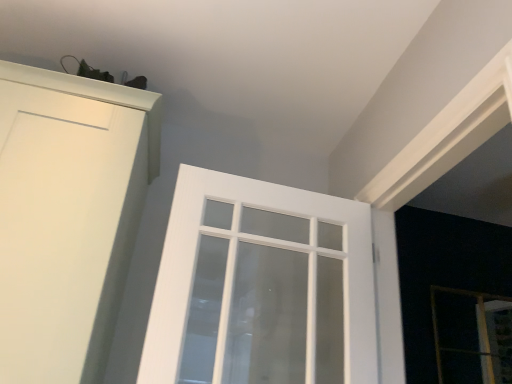
What do you see at coordinates (480, 326) in the screenshot? This screenshot has height=384, width=512. I see `transparent glass screen door at lower right` at bounding box center [480, 326].

This screenshot has width=512, height=384. I want to click on transparent glass screen door at lower right, so click(480, 326).

What is the approximate width of transparent glass screen door at lower right?

transparent glass screen door at lower right is 1.77 inches in width.

The image size is (512, 384). Find the location of `white textured glass door at center`. white textured glass door at center is located at coordinates (261, 286).

Describe the element at coordinates (261, 286) in the screenshot. I see `white textured glass door at center` at that location.

This screenshot has width=512, height=384. I want to click on transparent glass screen door at lower right, so click(480, 326).

Which is more to the left, transparent glass screen door at lower right or white textured glass door at center?

white textured glass door at center.

Is transparent glass screen door at lower right closer to the viewer compared to white textured glass door at center?

That is False.

Does point (478, 298) come behind point (272, 336)?

That is True.

From the image's perspective, is transparent glass screen door at lower right located above white textured glass door at center?

Actually, transparent glass screen door at lower right appears below white textured glass door at center in the image.

In the scene shown: From a real-world perspective, is transparent glass screen door at lower right positioned under white textured glass door at center based on gravity?

No, from a real-world perspective, transparent glass screen door at lower right is not below white textured glass door at center.

Between transparent glass screen door at lower right and white textured glass door at center, which one has smaller width?

With smaller width is transparent glass screen door at lower right.

Can you confirm if transparent glass screen door at lower right is shorter than white textured glass door at center?

Yes.

In the scene shown: Who is smaller, transparent glass screen door at lower right or white textured glass door at center?

With smaller size is transparent glass screen door at lower right.

Would you say white textured glass door at center is part of transparent glass screen door at lower right's contents?

No, white textured glass door at center is not a part of transparent glass screen door at lower right.

From the picture: Are transparent glass screen door at lower right and white textured glass door at center located far from each other?

No, transparent glass screen door at lower right is in close proximity to white textured glass door at center.

Does transparent glass screen door at lower right turn towards white textured glass door at center?

No, transparent glass screen door at lower right is not aimed at white textured glass door at center.

Find the location of `screen door below the white textured glass door at center (from the image's perspective)`. screen door below the white textured glass door at center (from the image's perspective) is located at coordinates (480, 326).

Can you confirm if white textured glass door at center is positioned to the right of transparent glass screen door at lower right?

No, white textured glass door at center is not to the right of transparent glass screen door at lower right.

In the scene shown: Is white textured glass door at center closer to camera compared to transparent glass screen door at lower right?

Yes.

Which point is more distant from viewer, [359,301] or [442,376]?

Positioned behind is point [442,376].

From the image's perspective, is white textured glass door at center above transparent glass screen door at lower right?

Yes, from the image's perspective, white textured glass door at center is over transparent glass screen door at lower right.

From a real-world perspective, is white textured glass door at center physically located above or below transparent glass screen door at lower right?

In terms of real-world spatial position, white textured glass door at center is below transparent glass screen door at lower right.

Between white textured glass door at center and transparent glass screen door at lower right, which one has smaller width?

Thinner between the two is transparent glass screen door at lower right.

Which of these two, white textured glass door at center or transparent glass screen door at lower right, stands shorter?

Standing shorter between the two is transparent glass screen door at lower right.

Considering the sizes of objects white textured glass door at center and transparent glass screen door at lower right in the image provided, who is bigger, white textured glass door at center or transparent glass screen door at lower right?

white textured glass door at center is bigger.

Could transparent glass screen door at lower right be considered to be inside white textured glass door at center?

No, transparent glass screen door at lower right is located outside of white textured glass door at center.

Are white textured glass door at center and transparent glass screen door at lower right making contact?

white textured glass door at center and transparent glass screen door at lower right are clearly separated.

Is white textured glass door at center looking in the opposite direction of transparent glass screen door at lower right?

white textured glass door at center does not have its back to transparent glass screen door at lower right.

Can you tell me how much white textured glass door at center and transparent glass screen door at lower right differ in facing direction?

The angular difference between white textured glass door at center and transparent glass screen door at lower right is 2.3 degrees.

How much distance is there between white textured glass door at center and transparent glass screen door at lower right?

They are 36.40 inches apart.

This screenshot has height=384, width=512. In order to click on window in front of the transparent glass screen door at lower right in this screenshot , I will do `click(261, 286)`.

This screenshot has height=384, width=512. I want to click on screen door that is above the white textured glass door at center (from a real-world perspective), so click(480, 326).

Locate an element on the screen. The height and width of the screenshot is (384, 512). window lying on the left of transparent glass screen door at lower right is located at coordinates click(x=261, y=286).